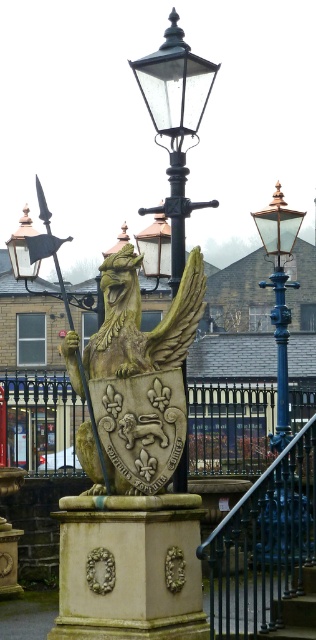
Question: From the image, what is the correct spatial relationship of black wrought iron fence at center in relation to black glass street light at center?

Choices:
 (A) right
 (B) left

Answer: (A)

Question: Can you confirm if stone textured pedestal at center is positioned to the right of black wrought iron fence at center?

Choices:
 (A) yes
 (B) no

Answer: (B)

Question: Among these points, which one is farthest from the camera?

Choices:
 (A) (41, 420)
 (B) (308, 492)
 (C) (192, 100)
 (D) (262, 228)

Answer: (A)

Question: Which point is closer to the camera?

Choices:
 (A) stone textured pedestal at center
 (B) black glass street light at center
 (C) stone/golden eagle at center

Answer: (C)

Question: Can you confirm if black wrought iron fence at center is positioned to the left of matte brass streetlight at center?

Choices:
 (A) yes
 (B) no

Answer: (A)

Question: Which of these objects is positioned farthest from the blue metal railing at lower center?

Choices:
 (A) black glass street light at center
 (B) black wrought iron fence at center
 (C) stone/golden eagle at center

Answer: (B)